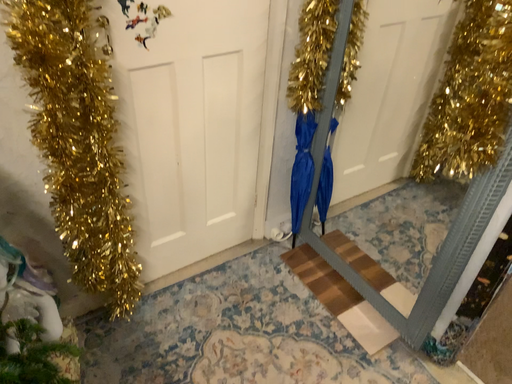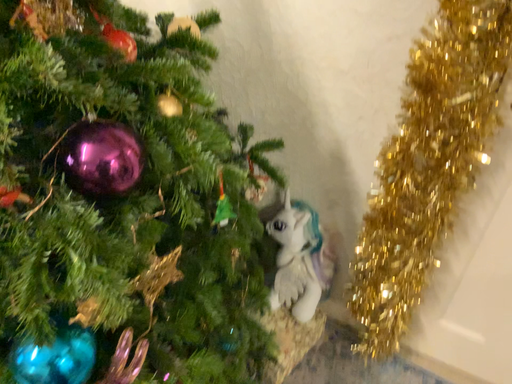
Question: How did the camera likely rotate when shooting the video?

Choices:
 (A) rotated right
 (B) rotated left

Answer: (B)